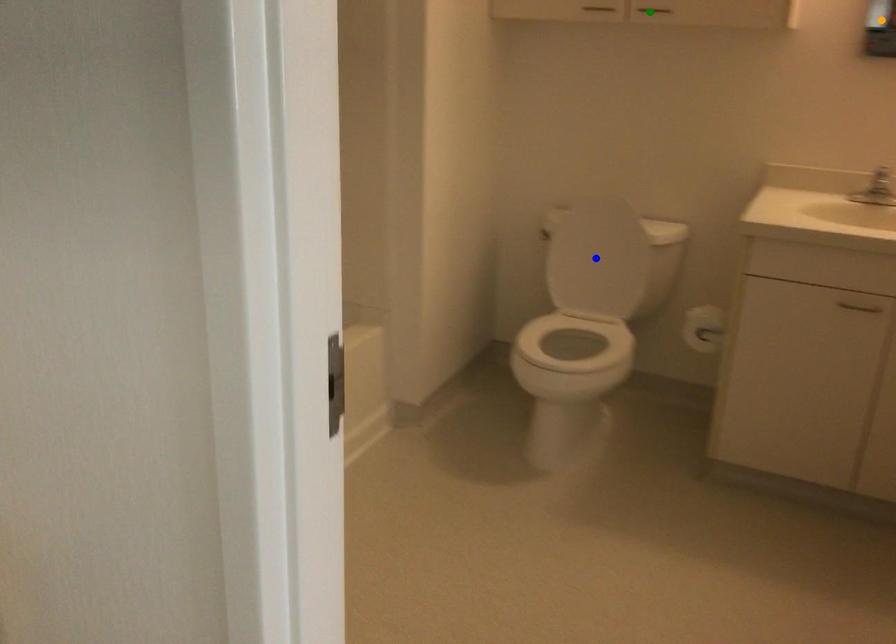
Order these from nearest to farthest:
blue point, orange point, green point

green point
orange point
blue point